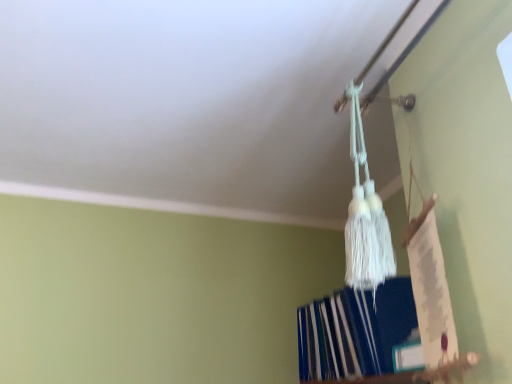
Question: In terms of height, does white tassel at upper center look taller or shorter compared to white matte trim at upper center?

Choices:
 (A) short
 (B) tall

Answer: (B)

Question: Would you say white tassel at upper center is inside or outside white matte trim at upper center?

Choices:
 (A) inside
 (B) outside

Answer: (B)

Question: From a real-world perspective, relative to white matte trim at upper center, is white tassel at upper center vertically above or below?

Choices:
 (A) below
 (B) above

Answer: (A)

Question: From the image's perspective, is white matte trim at upper center located above or below white tassel at upper center?

Choices:
 (A) above
 (B) below

Answer: (A)

Question: Relative to white tassel at upper center, is white matte trim at upper center in front or behind?

Choices:
 (A) front
 (B) behind

Answer: (B)

Question: In the image, is white matte trim at upper center on the left side or the right side of white tassel at upper center?

Choices:
 (A) right
 (B) left

Answer: (B)

Question: Is white matte trim at upper center wider or thinner than white tassel at upper center?

Choices:
 (A) thin
 (B) wide

Answer: (A)